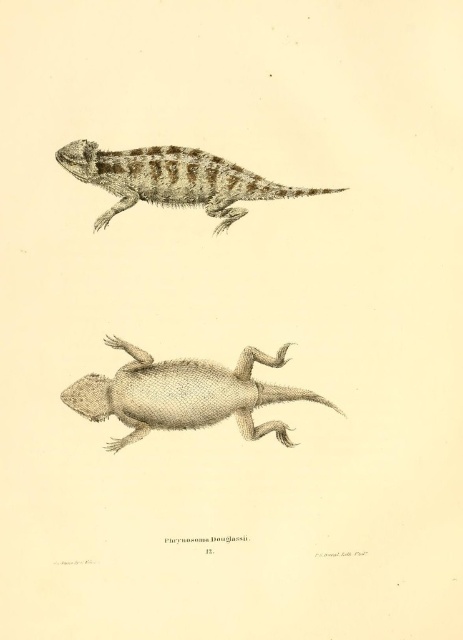
Which is behind, point (87, 413) or point (99, 161)?

Point (87, 413)

Can you confirm if smooth beige lizard at center is positioned to the left of brown textured lizard at upper center?

In fact, smooth beige lizard at center is to the right of brown textured lizard at upper center.

Is point (230, 371) farther from camera compared to point (106, 168)?

Yes, point (230, 371) is behind point (106, 168).

Where is `smooth beige lizard at center`? The width and height of the screenshot is (463, 640). smooth beige lizard at center is located at coordinates (183, 394).